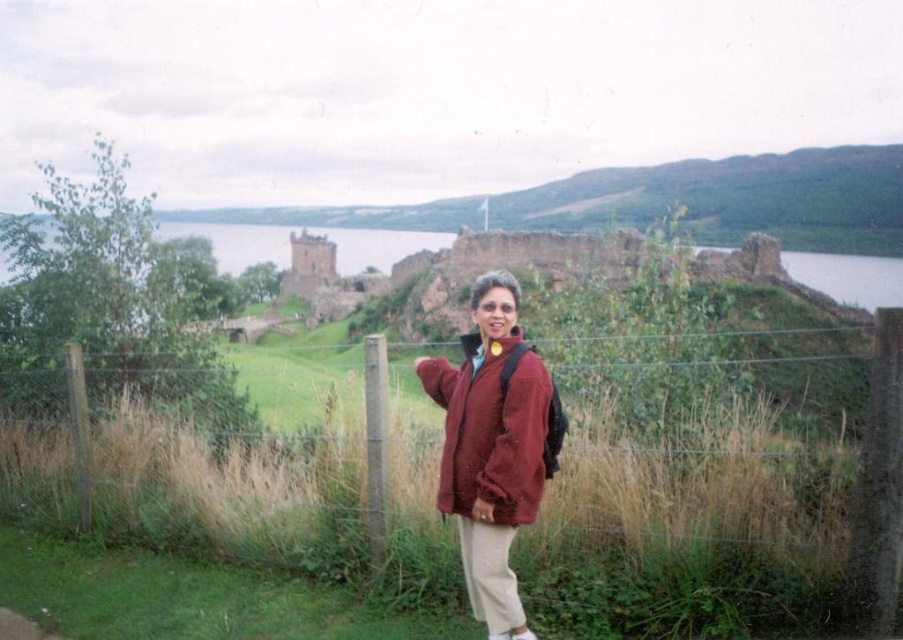
You are a hiker trying to take a photo of the stone brick castle at center. You are standing behind the wire mesh fence at center. Can you fit the entire castle in your camera frame without moving your position?

The wire mesh fence at center might be wider than stone brick castle at center, so there is a possibility that the fence could block part of the castle in your photo if its width exceeds the castle.

You are a photographer trying to capture the stone brick castle at center in the background while including the matte red jacket at center in the foreground. Can you frame the shot so that both are visible without one blocking the other?

The matte red jacket at center has a lesser height compared to the stone brick castle at center, so yes, you can frame the shot so that both are visible without one blocking the other by positioning the jacket lower in the frame and allowing the taller castle to stand behind it.